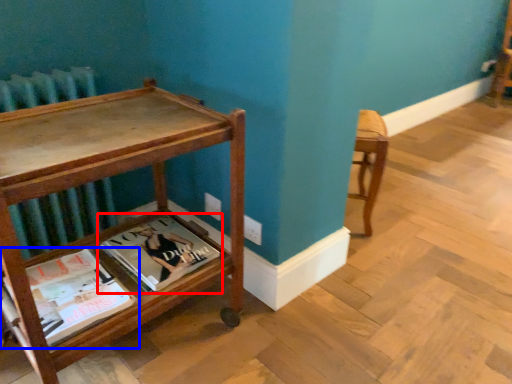
Question: Among these objects, which one is nearest to the camera, book (highlighted by a red box) or book (highlighted by a blue box)?

Choices:
 (A) book
 (B) book

Answer: (B)